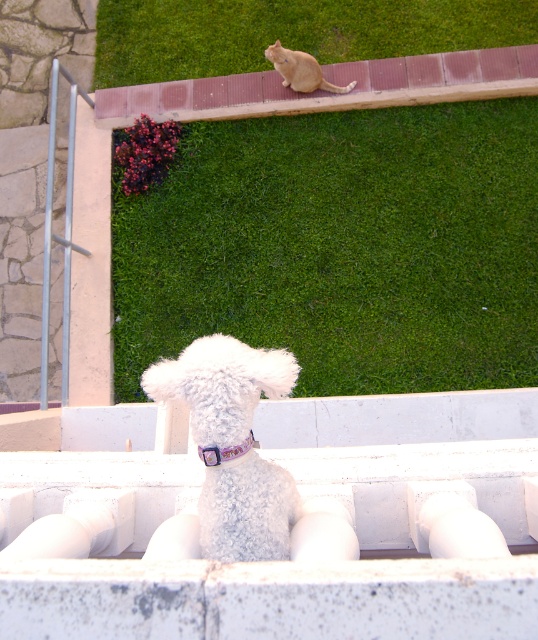
Question: Which object is the farthest from the white fluffy dog at upper center?

Choices:
 (A) white fluffy dog at center
 (B) purple satin neckband at center

Answer: (B)

Question: Is the position of green grass at upper center more distant than that of white fluffy dog at center?

Choices:
 (A) yes
 (B) no

Answer: (A)

Question: Which of the following is the farthest from the observer?

Choices:
 (A) (204, 454)
 (B) (291, 65)
 (C) (341, 138)
 (D) (214, 378)

Answer: (C)

Question: Which point is farther to the camera?

Choices:
 (A) white fluffy dog at center
 (B) white fluffy dog at upper center

Answer: (B)

Question: Can you confirm if green grass at upper center is thinner than white fluffy dog at center?

Choices:
 (A) yes
 (B) no

Answer: (B)

Question: Can you confirm if white fluffy dog at upper center is thinner than purple satin neckband at center?

Choices:
 (A) no
 (B) yes

Answer: (A)